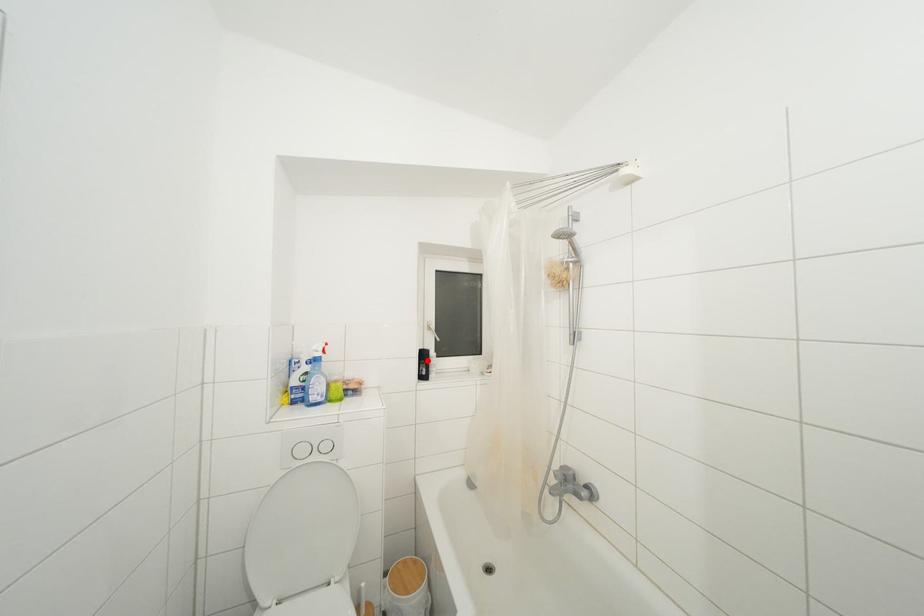
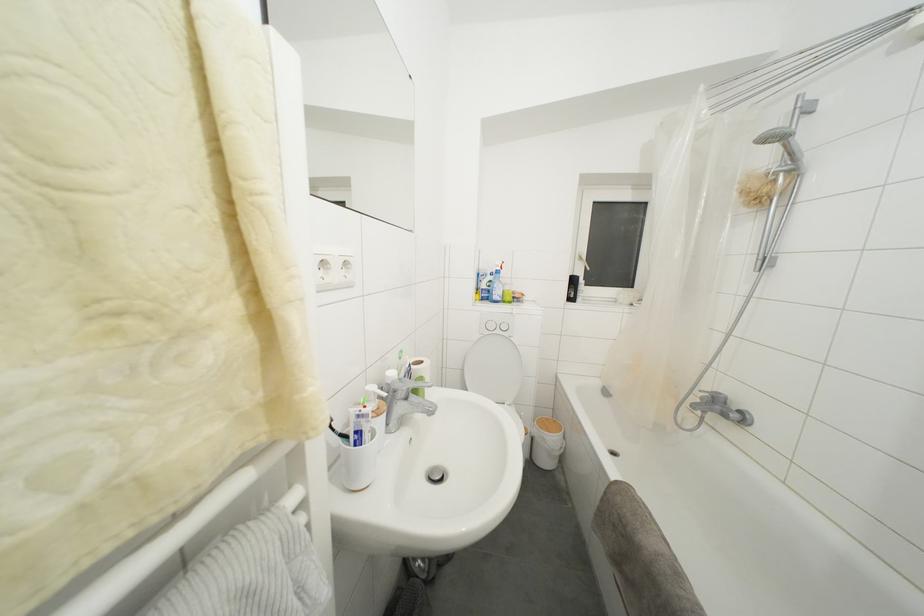
Locate, in the second image, the point that corresponds to the highlighted location in the first image.

(578, 286)